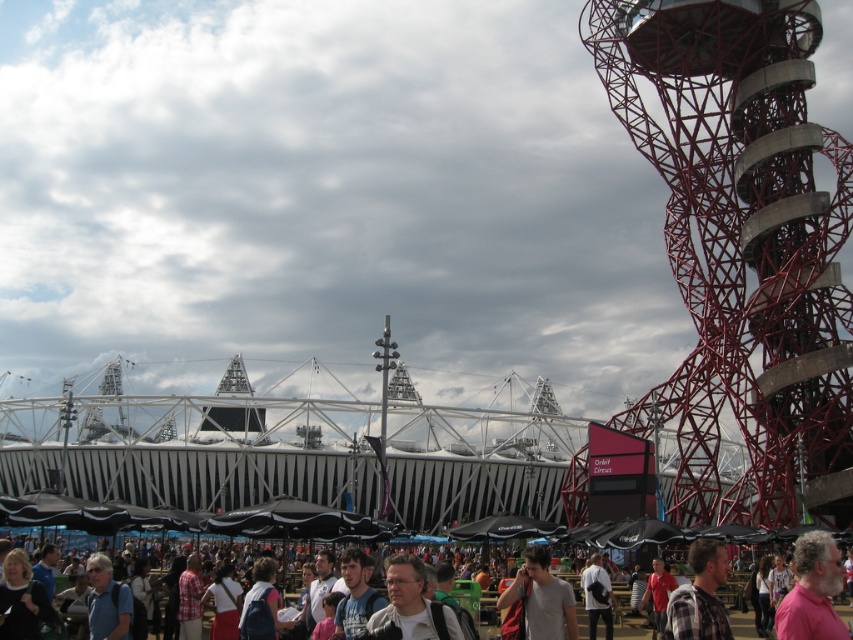
Question: Which point is farther to the camera?

Choices:
 (A) (605, 600)
 (B) (814, 364)
 (C) (724, 564)

Answer: (A)

Question: Is light gray fabric backpack at center behind dark gray backpack at lower center?

Choices:
 (A) yes
 (B) no

Answer: (B)

Question: Which point is farther to the camera?

Choices:
 (A) dark gray backpack at lower center
 (B) pink matte shirt at center

Answer: (A)

Question: Does light gray fabric backpack at center have a smaller size compared to gray fabric backpack at center?

Choices:
 (A) no
 (B) yes

Answer: (A)

Question: Which object appears closest to the camera in this image?

Choices:
 (A) light gray fabric backpack at center
 (B) gray fabric backpack at center

Answer: (A)

Question: Does plaid fabric shirt at center appear under gray fabric backpack at center?

Choices:
 (A) no
 (B) yes

Answer: (A)